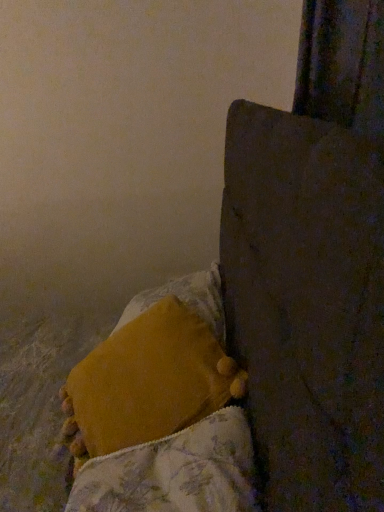
Question: Is velvety yellow pillow at lower center taller or shorter than wooden bedpost at upper right?

Choices:
 (A) short
 (B) tall

Answer: (A)

Question: Do you think velvety yellow pillow at lower center is within wooden bedpost at upper right, or outside of it?

Choices:
 (A) outside
 (B) inside

Answer: (B)

Question: Which object is the farthest from the fluffy yellow blanket at lower left?

Choices:
 (A) velvety yellow pillow at lower center
 (B) wooden bedpost at upper right

Answer: (B)

Question: Which object is positioned farthest from the wooden bedpost at upper right?

Choices:
 (A) velvety yellow pillow at lower center
 (B) fluffy yellow blanket at lower left

Answer: (A)